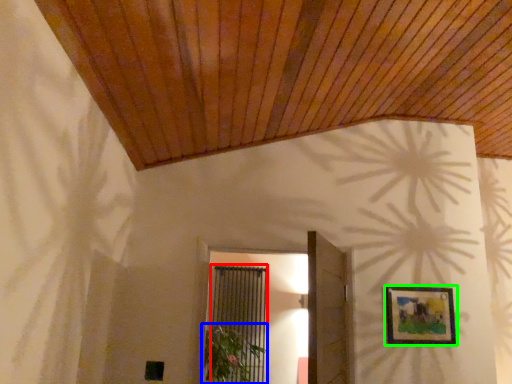
Question: Based on their relative distances, which object is farther from screen door (highlighted by a red box)? Choose from plant (highlighted by a blue box) and picture frame (highlighted by a green box).

Choices:
 (A) plant
 (B) picture frame

Answer: (B)